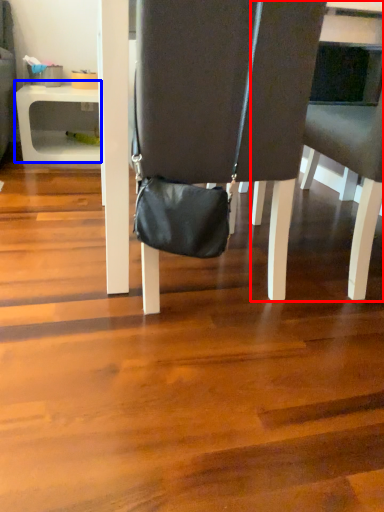
Question: Which object appears closest to the camera in this image, chair (highlighted by a red box) or table (highlighted by a blue box)?

Choices:
 (A) chair
 (B) table

Answer: (A)